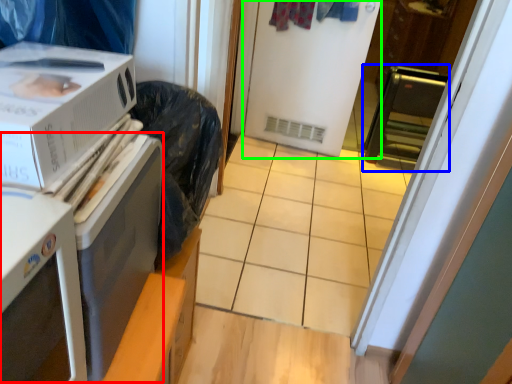
Question: Based on their relative distances, which object is nearer to appliance (highlighted by a red box)? Choose from appliance (highlighted by a blue box) and screen door (highlighted by a green box).

Choices:
 (A) appliance
 (B) screen door

Answer: (B)